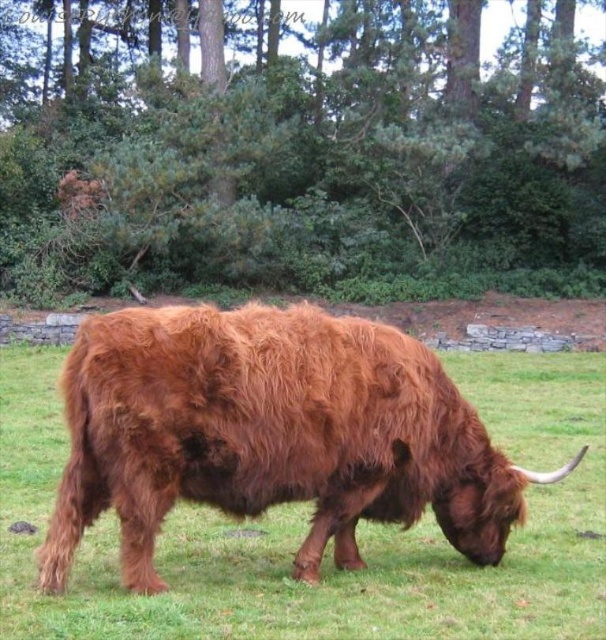
Does green leafy tree at center appear on the right side of brown fuzzy bull at center?

No, green leafy tree at center is not to the right of brown fuzzy bull at center.

Where is `green leafy tree at center`? Image resolution: width=606 pixels, height=640 pixels. green leafy tree at center is located at coordinates (305, 157).

The height and width of the screenshot is (640, 606). I want to click on green leafy tree at center, so click(305, 157).